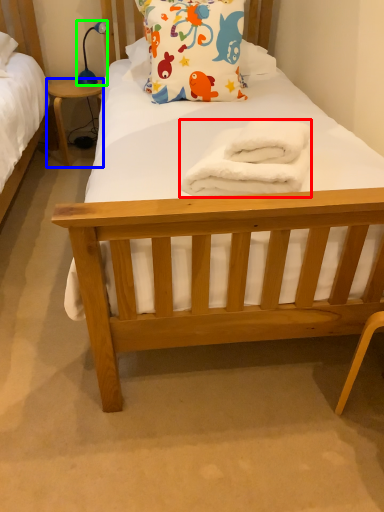
Question: Which is nearer to the towel/napkin (highlighted by a red box)? desk (highlighted by a blue box) or lamp (highlighted by a green box).

Choices:
 (A) desk
 (B) lamp

Answer: (A)